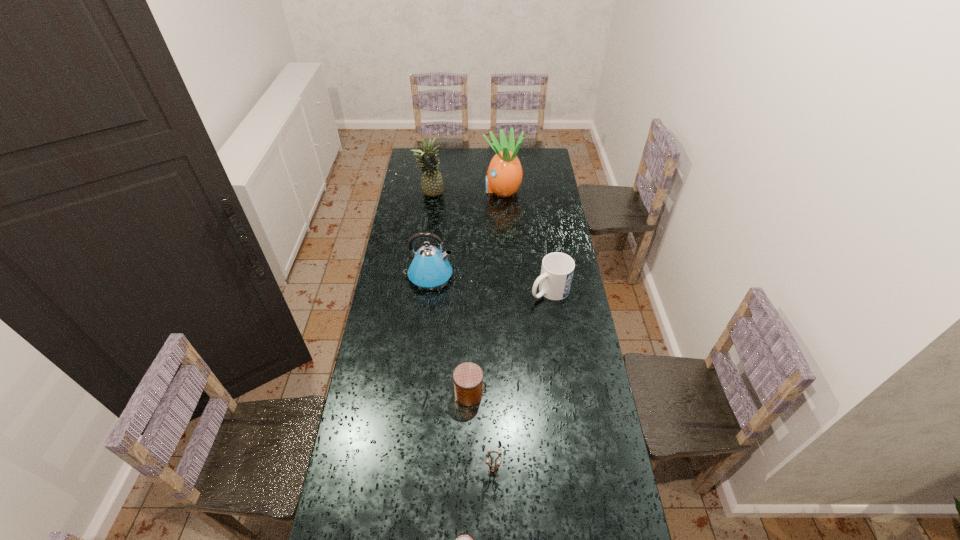
Locate an element on the screen. empty space between the left pineapple and the right pineapple is located at coordinates (467, 192).

Image resolution: width=960 pixels, height=540 pixels. I want to click on unoccupied position between the jar and the right pineapple, so click(486, 292).

Locate an element on the screen. Image resolution: width=960 pixels, height=540 pixels. unoccupied position between the jar and the second nearest object is located at coordinates (481, 432).

The width and height of the screenshot is (960, 540). Find the location of `vacant area that lies between the left pineapple and the candle holder`. vacant area that lies between the left pineapple and the candle holder is located at coordinates (462, 333).

Identify the location of free point between the mug and the second nearest object. (521, 381).

Find the location of a particular element. The height and width of the screenshot is (540, 960). free area in between the left pineapple and the third nearest object is located at coordinates (449, 294).

I want to click on empty space that is in between the left pineapple and the candle holder, so click(x=462, y=333).

Image resolution: width=960 pixels, height=540 pixels. What are the coordinates of `free point between the kettle and the fifth farthest object` in the screenshot? It's located at (448, 334).

Identify which object is located as the fourth nearest to the left pineapple. Please provide its 2D coordinates. Your answer should be formatted as a tuple, i.e. [(x, y)], where the tuple contains the x and y coordinates of a point satisfying the conditions above.

[(467, 377)]

Find the location of a particular element. The width and height of the screenshot is (960, 540). object that stands as the fourth closest to the second nearest object is located at coordinates (429, 268).